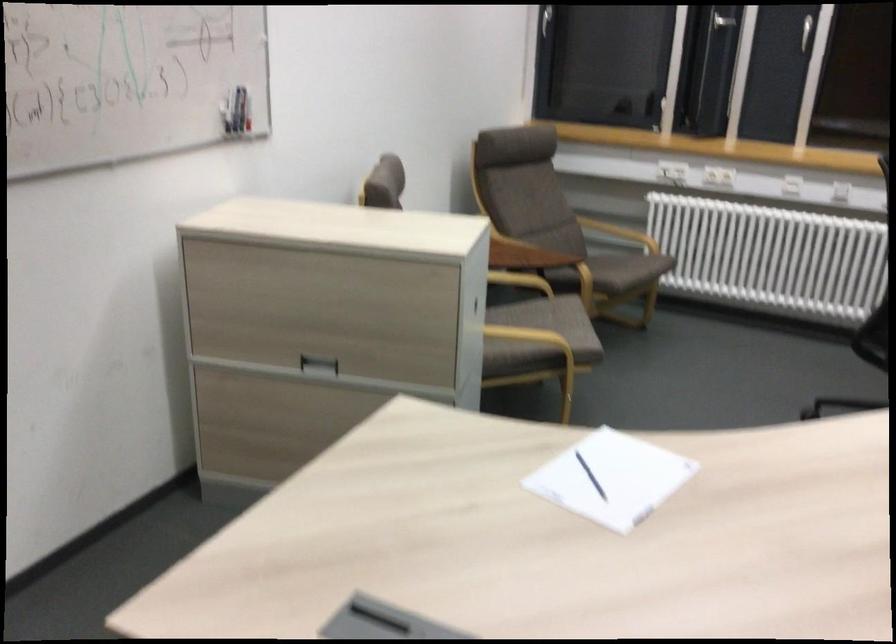
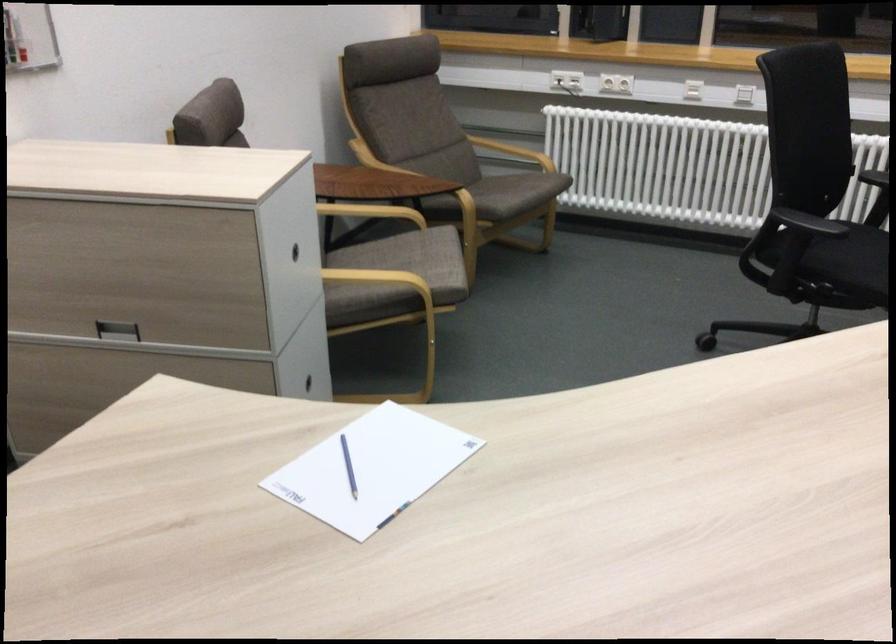
In the second image, find the point that corresponds to (x=548, y=321) in the first image.

(412, 259)